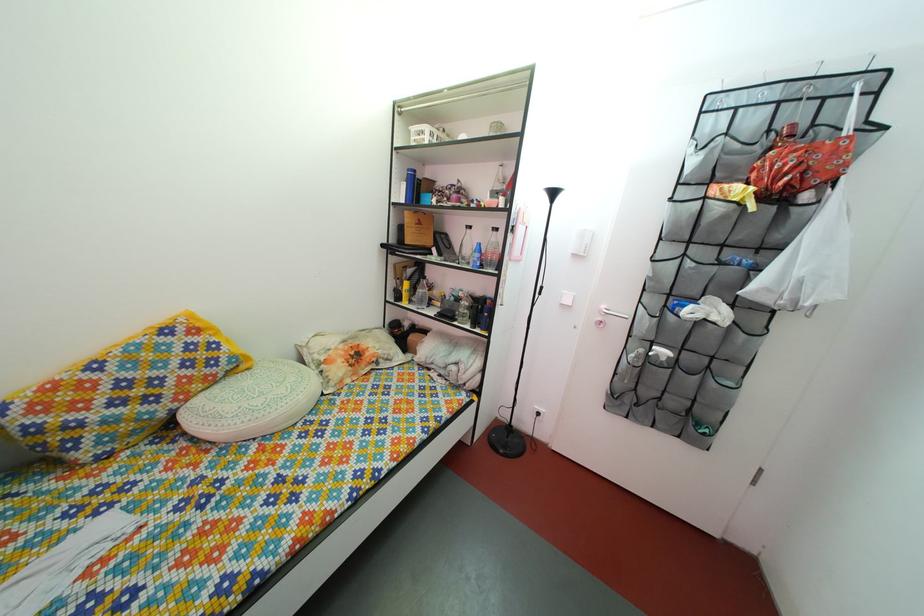
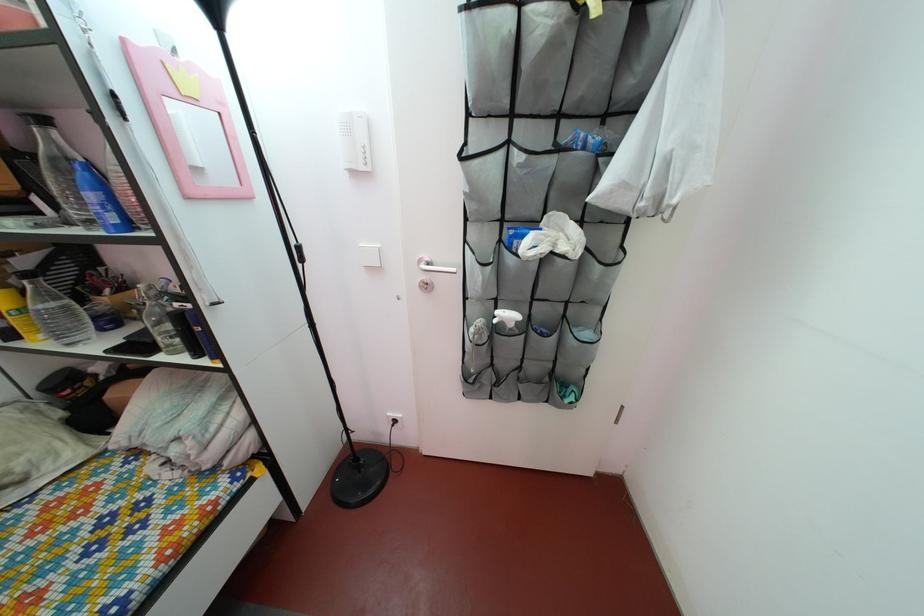
The point at (808, 281) is marked in the first image. Where is the corresponding point in the second image?

(675, 152)